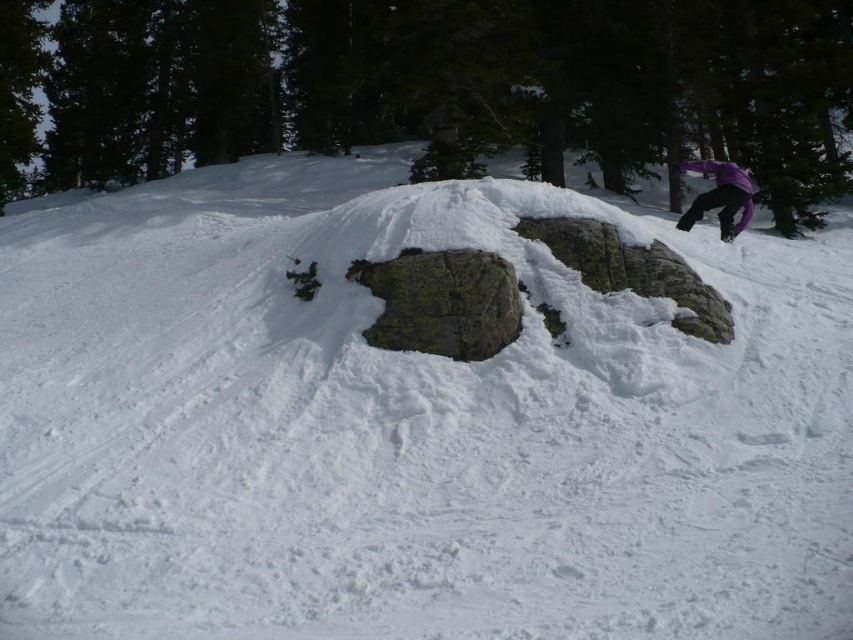
You are a photographer positioned at the bottom of the slope. You want to take a photo that includes both the gray rough rock at center and the purple matte snowboarder at upper right. Which object should you adjust your camera angle to focus on first to ensure both are in frame?

You should focus on the gray rough rock at center first since it is closer to the viewer than the purple matte snowboarder at upper right, allowing you to frame both objects effectively.

From the picture: You are a snowboarder who just finished a run and want to check your position relative to landmarks. You see the gray rough rock at center and the purple matte snowboarder at upper right. Which object is positioned lower in the image?

The gray rough rock at center is located below the purple matte snowboarder at upper right, so the gray rough rock at center is positioned lower in the image.

You are a snowboarder planning to navigate through the snowy slope. You see the gray rough rock at center and the purple matte snowboarder at upper right. Which object is closer to the ground?

The gray rough rock at center is shorter than the purple matte snowboarder at upper right, so the gray rough rock at center is closer to the ground.